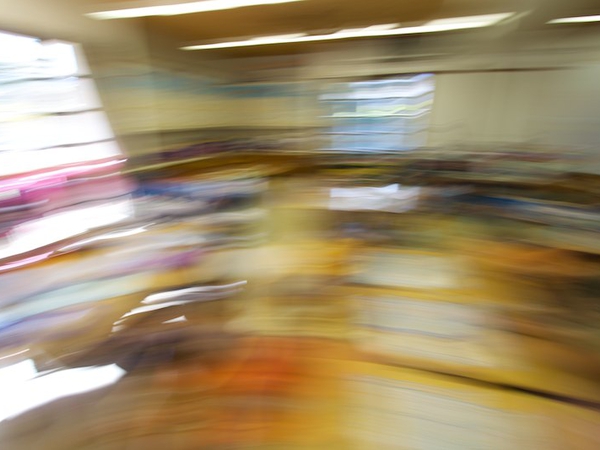
Where is `floor`? The image size is (600, 450). floor is located at coordinates (317, 387).